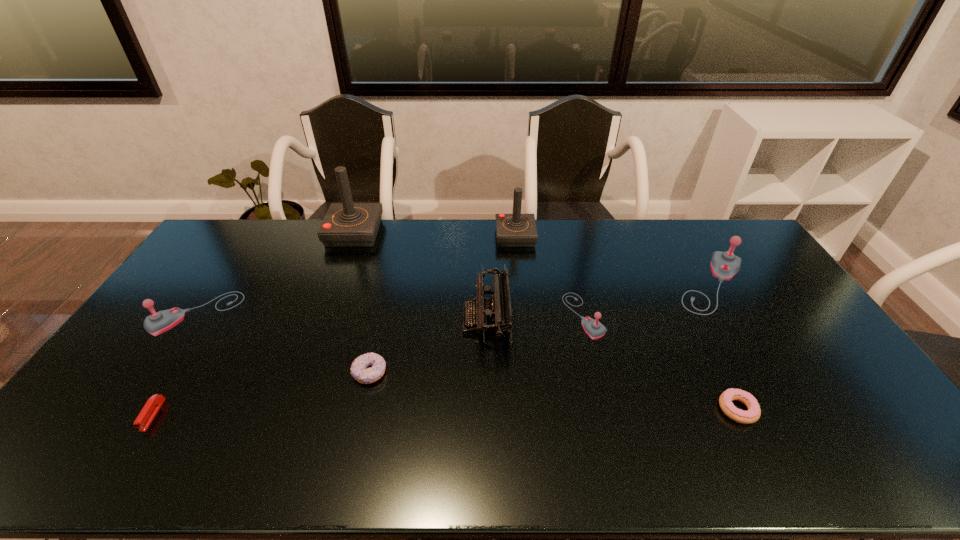
Where is `free space that satisfies the following two spatial constraints: 1. on the rectangular base of the left red joystick; 2. on the right side of the seventh object from left to right`? Image resolution: width=960 pixels, height=540 pixels. free space that satisfies the following two spatial constraints: 1. on the rectangular base of the left red joystick; 2. on the right side of the seventh object from left to right is located at coordinates (324, 315).

Where is `free space that satisfies the following two spatial constraints: 1. on the rectangular base of the tallest joystick; 2. on the front-facing side of the red stapler`? The width and height of the screenshot is (960, 540). free space that satisfies the following two spatial constraints: 1. on the rectangular base of the tallest joystick; 2. on the front-facing side of the red stapler is located at coordinates (287, 415).

What are the coordinates of `vacant region that satisfies the following two spatial constraints: 1. on the front side of the second joystick from right to left; 2. on the left side of the pink doughnut` in the screenshot? It's located at 607,409.

The image size is (960, 540). In order to click on free spot that satisfies the following two spatial constraints: 1. on the back side of the smallest gray joystick; 2. on the left side of the biggest gray joystick in this screenshot , I will do `click(576, 284)`.